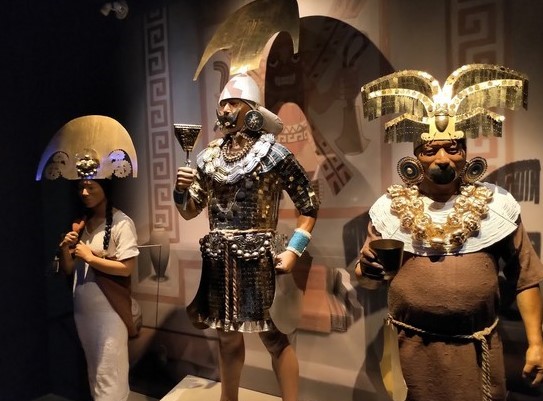
Image resolution: width=543 pixels, height=401 pixels. Identify the location of copper cup. (391, 255).